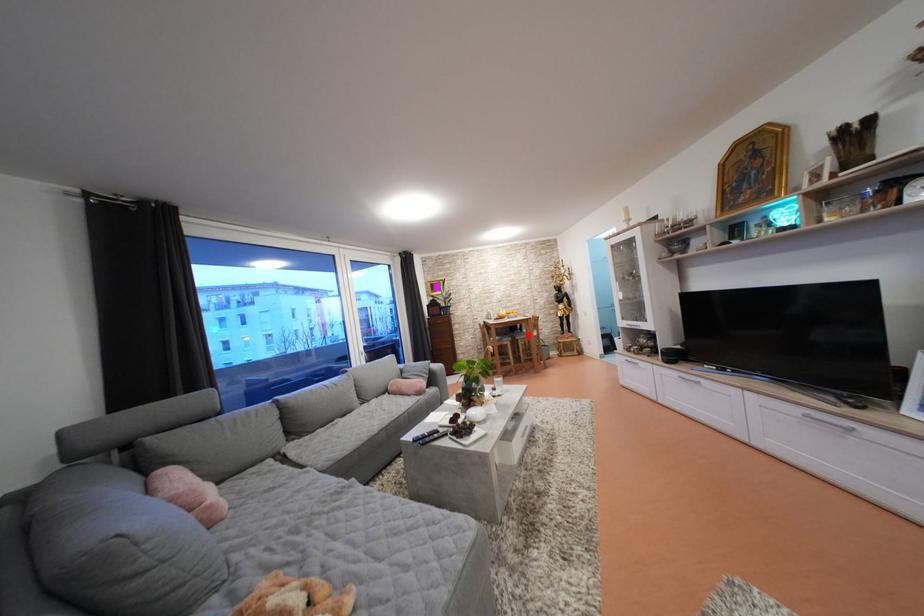
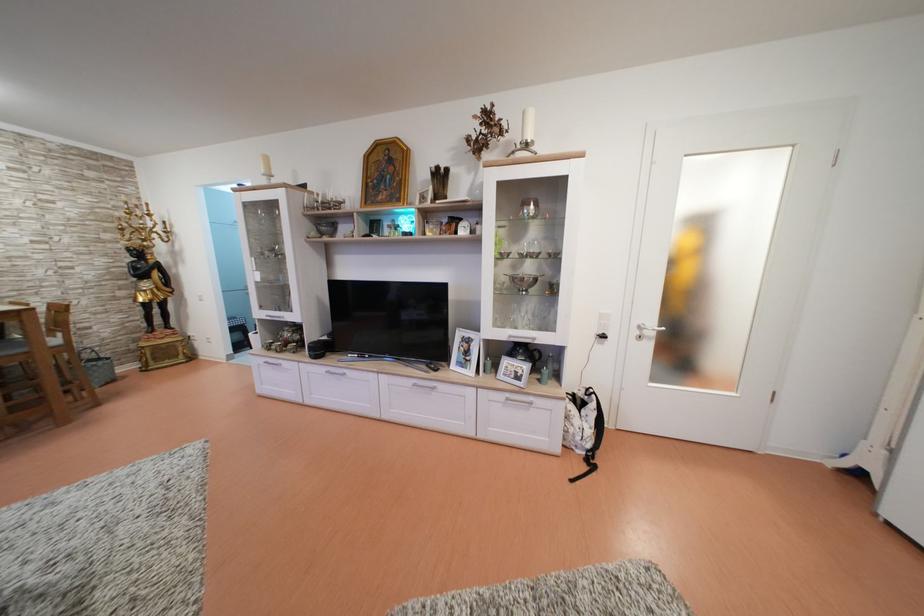
Find the pixel in the second image that matches the highlighted location in the first image.

(7, 339)